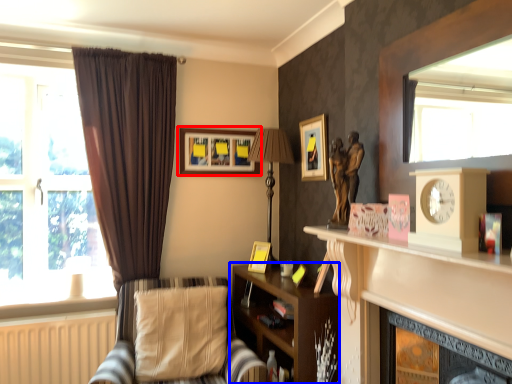
Question: Which of the following is the closest to the observer, picture frame (highlighted by a red box) or shelf (highlighted by a blue box)?

Choices:
 (A) picture frame
 (B) shelf

Answer: (B)